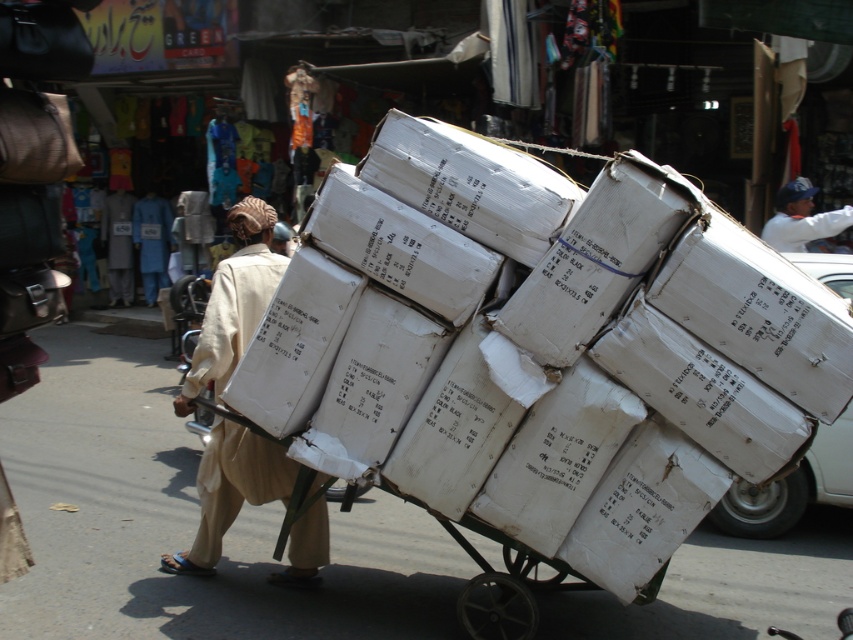
Question: Can you confirm if white cardboard boxes at center is thinner than blue cotton robe at center?

Choices:
 (A) yes
 (B) no

Answer: (B)

Question: Which object appears closest to the camera in this image?

Choices:
 (A) light brown cotton robe at center
 (B) white cardboard boxes at center
 (C) white cotton shirt at upper right

Answer: (B)

Question: Is white cardboard boxes at center closer to the viewer compared to light brown cotton robe at center?

Choices:
 (A) yes
 (B) no

Answer: (A)

Question: Is white cotton shirt at upper right wider than light brown cotton robe at center?

Choices:
 (A) yes
 (B) no

Answer: (A)

Question: Which object is closer to the camera taking this photo?

Choices:
 (A) white cotton shirt at upper right
 (B) light brown cotton robe at center
 (C) blue cotton robe at center

Answer: (A)

Question: Which point is closer to the camera taking this photo?

Choices:
 (A) (151, 225)
 (B) (132, 205)
 (C) (218, 477)

Answer: (C)